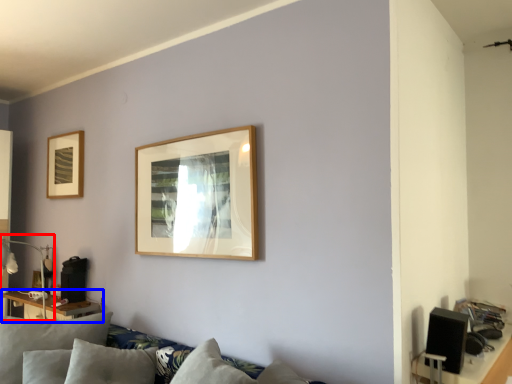
Question: Which object appears farthest to the camera in this image, lamp (highlighted by a red box) or table (highlighted by a blue box)?

Choices:
 (A) lamp
 (B) table

Answer: (B)